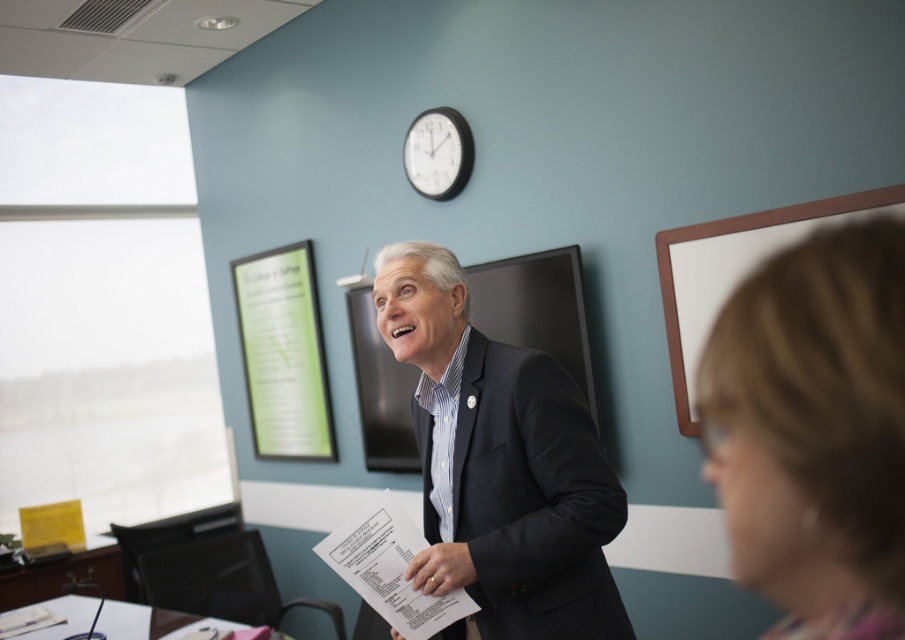
You are an office assistant who needs to take a photo of the man for an ID badge. The photo must clearly show both his blonde hair at lower right and dark gray suit at center. Which part of his appearance will be more visible in the photo?

The blonde hair at lower right will be more visible in the photo because it is in front of the dark gray suit at center.

You are an interior designer planning to place a new decorative item in the office. The item requires a space wider than the dark gray suit at center. Can the white matte board at upper right provide enough width for this item?

The dark gray suit at center is wider than the white matte board at upper right. Therefore, the white matte board at upper right cannot accommodate the item requiring space wider than the dark gray suit at center.

You are an interior designer assessing the office layout. The dark gray suit at center and the white matte board at upper right are both in view. Which object has a greater height?

The dark gray suit at center is much taller than the white matte board at upper right, so the dark gray suit at center has a greater height.